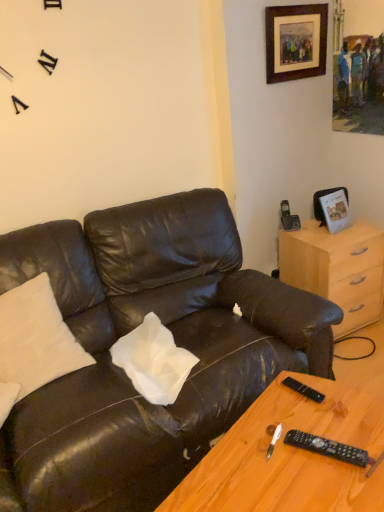
You are a GUI agent. You are given a task and a screenshot of the screen. Output one action in this format:
    pyautogui.click(x=<x>, y=<y>)
    Task: Click on the vacant space to the right of black plastic remote at lower right, which is the second remote from front to back
    Image resolution: width=384 pixels, height=512 pixels.
    Given the screenshot: What is the action you would take?
    (x=342, y=397)